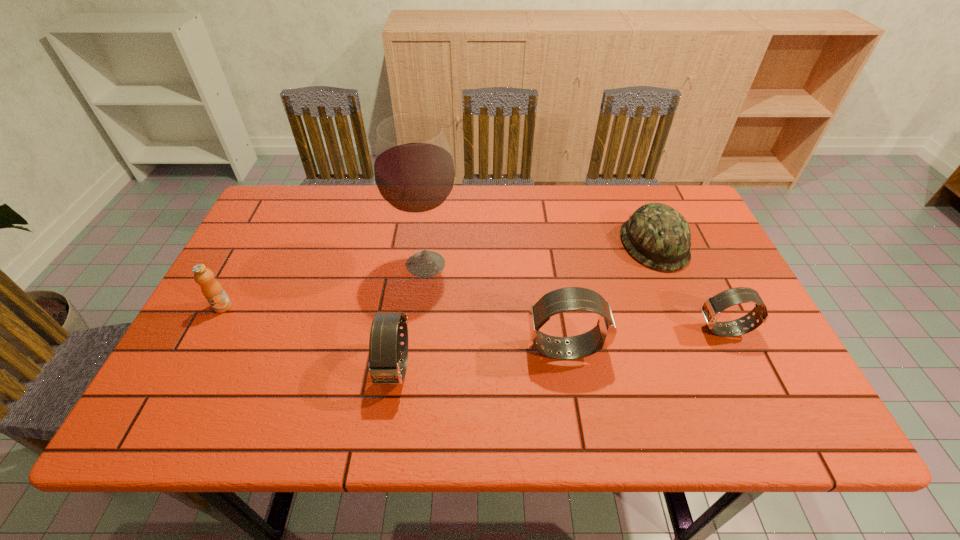
Please point a vacant point for placing a watch on the left. Please provide its 2D coordinates. Your answer should be formatted as a tuple, i.e. [(x, y)], where the tuple contains the x and y coordinates of a point satisfying the conditions above.

[(212, 388)]